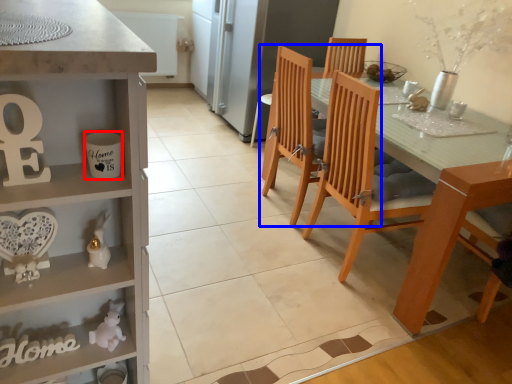
Question: Among these objects, which one is farthest to the camera, coffee cup (highlighted by a red box) or chair (highlighted by a blue box)?

Choices:
 (A) coffee cup
 (B) chair

Answer: (B)